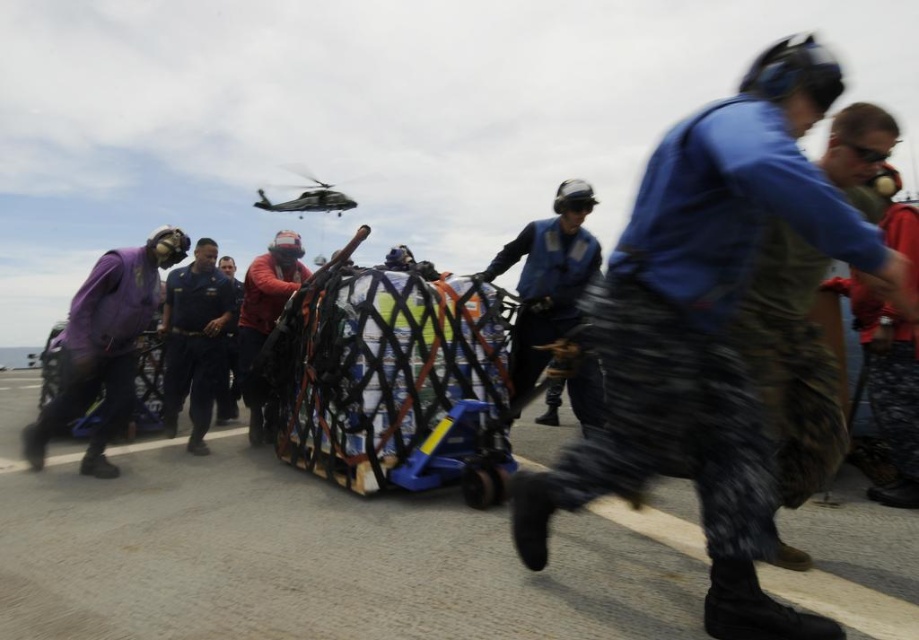
From the picture: What is the color of the object located at point [105,346]?

The object at point [105,346] is purple fabric.

You are a military commander observing the scene from a control room. You need to determine if the blue uniform at center is within the safe distance of 5 meters for direct communication. Can you confirm?

The blue uniform at center is 4.17 meters away from the camera, which is within the 5 meters safe distance for direct communication.

You are a military observer positioned behind both the camo fabric uniform at center and the blue uniform at center. Which uniform is closer to you?

The camo fabric uniform at center is closer to you than the blue uniform at center.